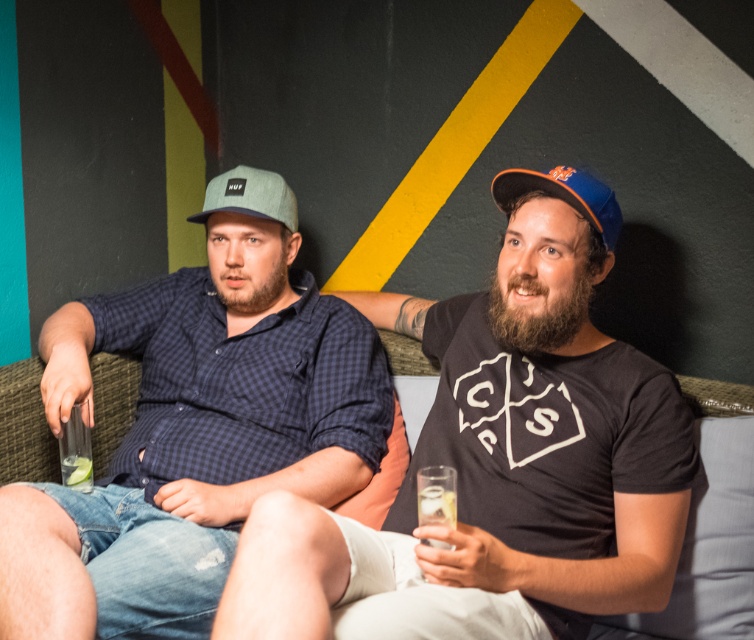
You are trying to place a small decorative item on the couch between the blue fabric baseball cap at right and the clear glass at right. Which object should you place it closer to if you want it to be near the wider object?

The blue fabric baseball cap at right is wider than the clear glass at right, so you should place the decorative item closer to the blue fabric baseball cap at right.

You are a photographer setting up a shoot in the living room. You have a camera that can only focus on objects larger than 1 meter in height. You see the green fabric couch at center and the matte green baseball cap at center in the scene. Can both objects be in focus at the same time?

The green fabric couch at center is larger in size than the matte green baseball cap at center. Since the camera requires objects to be larger than 1 meter in height to focus, only the green fabric couch at center may qualify, while the baseball cap might be too small. However, without specific size measurements, it is uncertain if both meet the requirement.